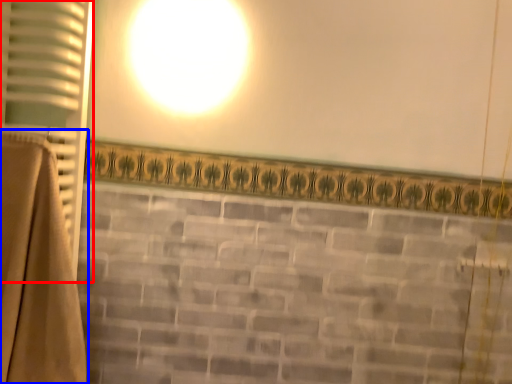
Question: Which of the following is the closest to the observer, curtain (highlighted by a red box) or curtain (highlighted by a blue box)?

Choices:
 (A) curtain
 (B) curtain

Answer: (B)